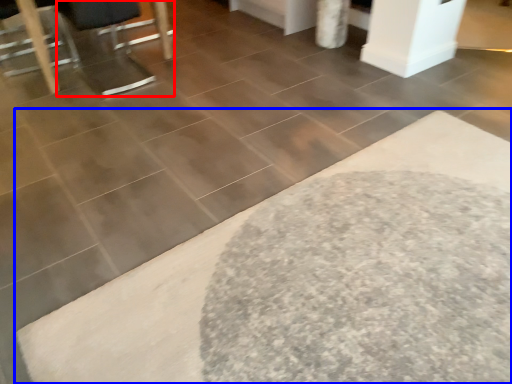
Question: Which point is closer to the camera, swivel chair (highlighted by a red box) or bath mat (highlighted by a blue box)?

Choices:
 (A) swivel chair
 (B) bath mat

Answer: (B)